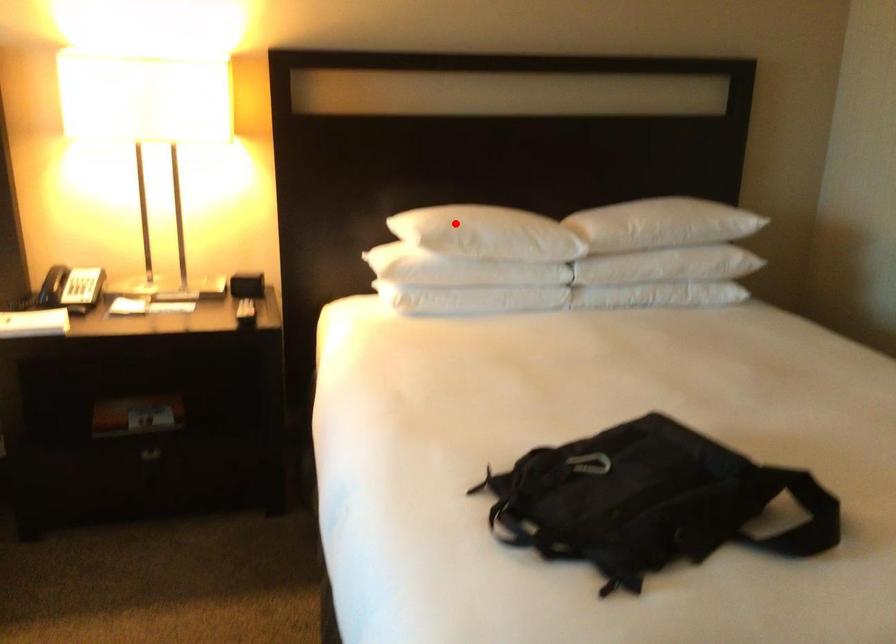
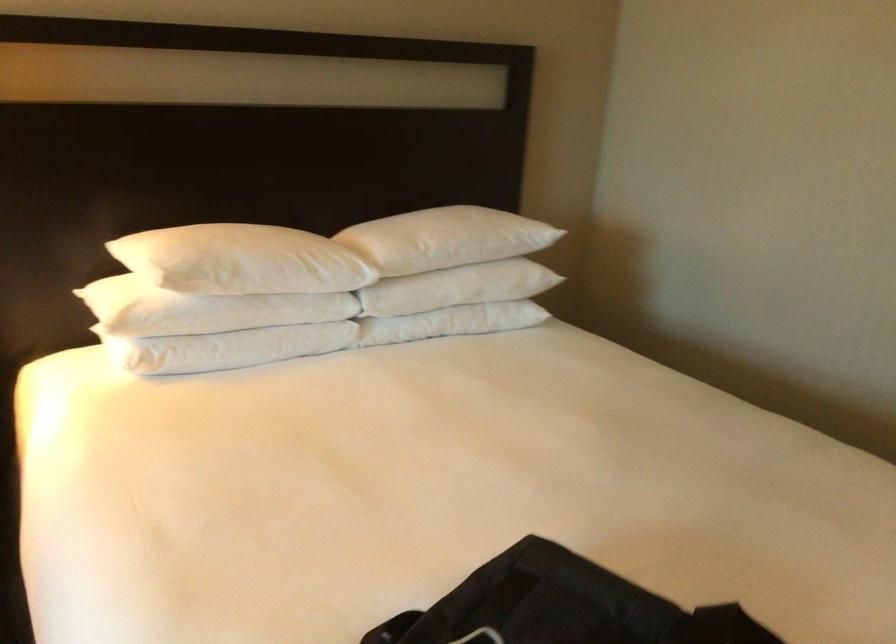
Locate, in the second image, the point that corresponds to the highlighted location in the first image.

(211, 254)